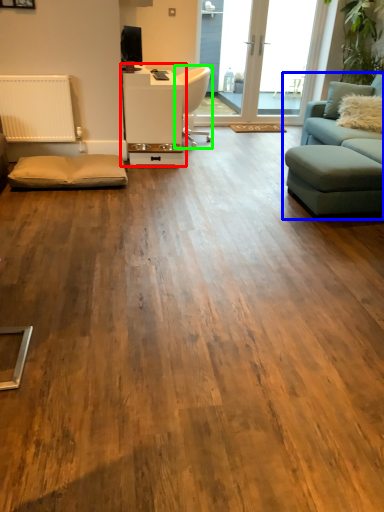
Question: Which object is the farthest from table (highlighted by a red box)? Choose among these: studio couch (highlighted by a blue box) or chair (highlighted by a green box).

Choices:
 (A) studio couch
 (B) chair

Answer: (A)